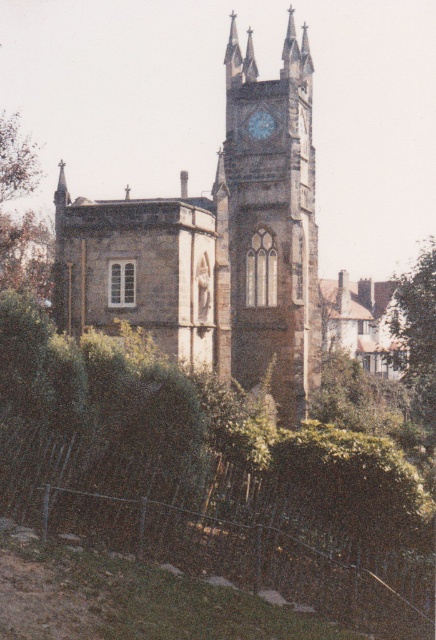
Does point (91, 291) lie in front of point (426, 244)?

That is True.

Is stone clock tower at center to the left of green leafy tree at upper right from the viewer's perspective?

Correct, you'll find stone clock tower at center to the left of green leafy tree at upper right.

Between point (231, 177) and point (428, 340), which one is positioned behind?

The point (428, 340) is more distant.

Identify the location of stone clock tower at center. (215, 244).

Can you confirm if brown stone clock tower at center is positioned to the right of metallic clock face at upper center?

Yes, brown stone clock tower at center is to the right of metallic clock face at upper center.

Is brown stone clock tower at center above metallic clock face at upper center?

Incorrect, brown stone clock tower at center is not positioned above metallic clock face at upper center.

Does point (306, 54) lie behind point (268, 132)?

Yes, point (306, 54) is behind point (268, 132).

The image size is (436, 640). I want to click on brown stone clock tower at center, so click(272, 225).

Can you confirm if stone clock tower at center is positioned above metallic clock face at upper center?

Actually, stone clock tower at center is below metallic clock face at upper center.

Who is more forward, (135, 292) or (268, 136)?

Positioned in front is point (135, 292).

You are a GUI agent. You are given a task and a screenshot of the screen. Output one action in this format:
    pyautogui.click(x=<x>, y=<y>)
    Task: Click on the stone clock tower at center
    The width and height of the screenshot is (436, 640).
    Given the screenshot: What is the action you would take?
    pyautogui.click(x=215, y=244)